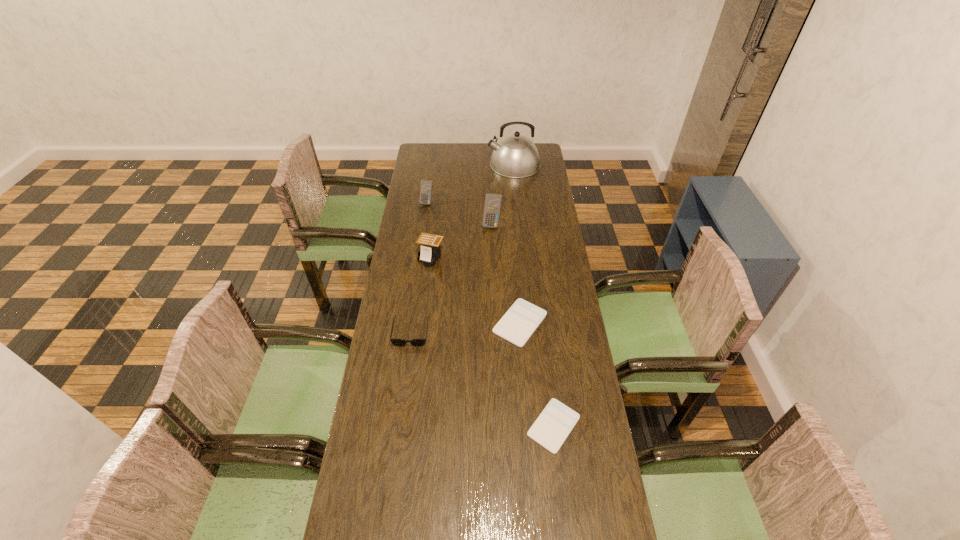
At what (x,y) coordinates should I click in order to perform the action: click on object identified as the sixth closest to the fifth tallest object. Please return your answer as a coordinate pair (x, y). Looking at the image, I should click on (516, 156).

Where is `the closest calculator to the kettle`? The image size is (960, 540). the closest calculator to the kettle is located at coordinates (426, 186).

Find the location of `calculator that is the second closest one to the farther white calculator`. calculator that is the second closest one to the farther white calculator is located at coordinates (430, 251).

Choose which white calculator is the second nearest neighbor to the third farthest calculator. Please provide its 2D coordinates. Your answer should be formatted as a tuple, i.e. [(x, y)], where the tuple contains the x and y coordinates of a point satisfying the conditions above.

[(552, 427)]

Locate which white calculator is the closest to the third shortest object. Please provide its 2D coordinates. Your answer should be formatted as a tuple, i.e. [(x, y)], where the tuple contains the x and y coordinates of a point satisfying the conditions above.

[(518, 324)]

At what (x,y) coordinates should I click in order to perform the action: click on vacant space that satisfies the following two spatial constraints: 1. at the front lenses of the nearest calculator; 2. on the left side of the third shortest object. Please return your answer as a coordinate pair (x, y). The image size is (960, 540). Looking at the image, I should click on (398, 426).

At what (x,y) coordinates should I click in order to perform the action: click on blank area in the image that satisfies the following two spatial constraints: 1. from the spout of the tallest object; 2. on the front-facing side of the sixth nearest object. Please return your answer as a coordinate pair (x, y). The image size is (960, 540). Looking at the image, I should click on (517, 202).

Image resolution: width=960 pixels, height=540 pixels. What are the coordinates of `vacant space that satisfies the following two spatial constraints: 1. on the front-facing side of the shortest calculator; 2. on the right side of the second tallest object` in the screenshot? It's located at (497, 426).

You are a GUI agent. You are given a task and a screenshot of the screen. Output one action in this format:
    pyautogui.click(x=<x>, y=<y>)
    Task: Click on the vacant space that satisfies the following two spatial constraints: 1. at the front lenses of the fifth tallest object; 2. on the left side of the shortest object
    The width and height of the screenshot is (960, 540).
    Given the screenshot: What is the action you would take?
    pyautogui.click(x=398, y=426)

The height and width of the screenshot is (540, 960). Find the location of `vacant space that satisfies the following two spatial constraints: 1. on the front side of the second shortest object; 2. on the left side of the smaller white calculator`. vacant space that satisfies the following two spatial constraints: 1. on the front side of the second shortest object; 2. on the left side of the smaller white calculator is located at coordinates (528, 426).